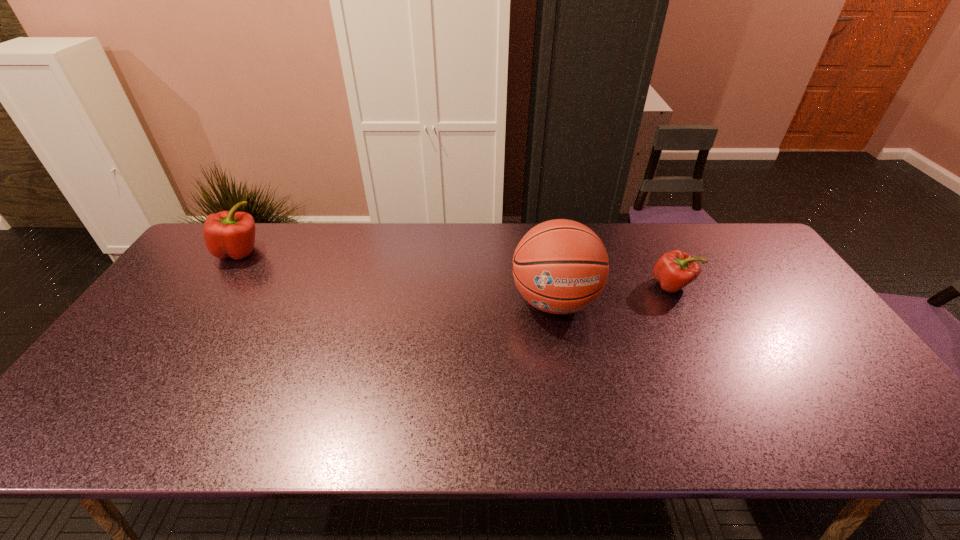
In order to click on vacant space that's between the left bell pepper and the shorter bell pepper in this screenshot , I will do `click(456, 268)`.

Find the location of a particular element. Image resolution: width=960 pixels, height=540 pixels. free space between the second object from left to right and the farthest object is located at coordinates (397, 276).

Locate an element on the screen. The width and height of the screenshot is (960, 540). free point between the second tallest object and the shortest object is located at coordinates (456, 268).

Image resolution: width=960 pixels, height=540 pixels. In order to click on free space between the left bell pepper and the right bell pepper in this screenshot , I will do `click(456, 268)`.

The height and width of the screenshot is (540, 960). I want to click on free area in between the rightmost object and the basketball, so click(x=613, y=293).

At what (x,y) coordinates should I click in order to perform the action: click on free area in between the shortest object and the second object from right to left. Please return your answer as a coordinate pair (x, y). Looking at the image, I should click on (613, 293).

Where is `vacant area that lies between the left bell pepper and the rightmost object`? This screenshot has height=540, width=960. vacant area that lies between the left bell pepper and the rightmost object is located at coordinates (456, 268).

At what (x,y) coordinates should I click in order to perform the action: click on unoccupied area between the tallest object and the second tallest object. Please return your answer as a coordinate pair (x, y). This screenshot has width=960, height=540. Looking at the image, I should click on (397, 276).

Select which object is the second closest to the shortest object. Please provide its 2D coordinates. Your answer should be formatted as a tuple, i.e. [(x, y)], where the tuple contains the x and y coordinates of a point satisfying the conditions above.

[(231, 234)]

Find the location of a particular element. the second closest object to the second object from left to right is located at coordinates (231, 234).